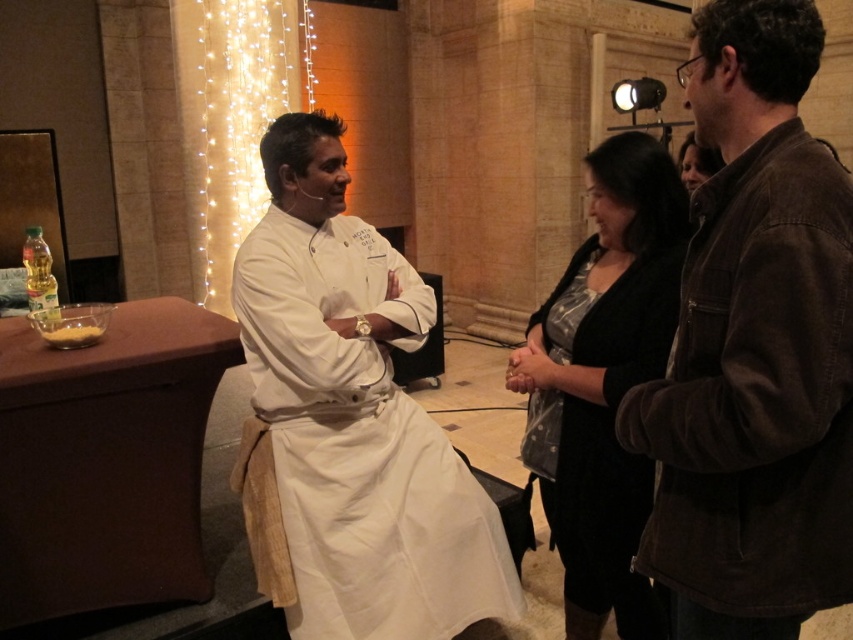
You are standing in the room and want to move closer to the chef. There are two points marked in the scene, point (450, 541) and point (604, 333). Which point should you walk towards to get closer to the chef?

Point (450, 541) is further to the viewer than point (604, 333). Therefore, walking towards point (450, 541) would bring you closer to the chef since it is nearer to your current position.